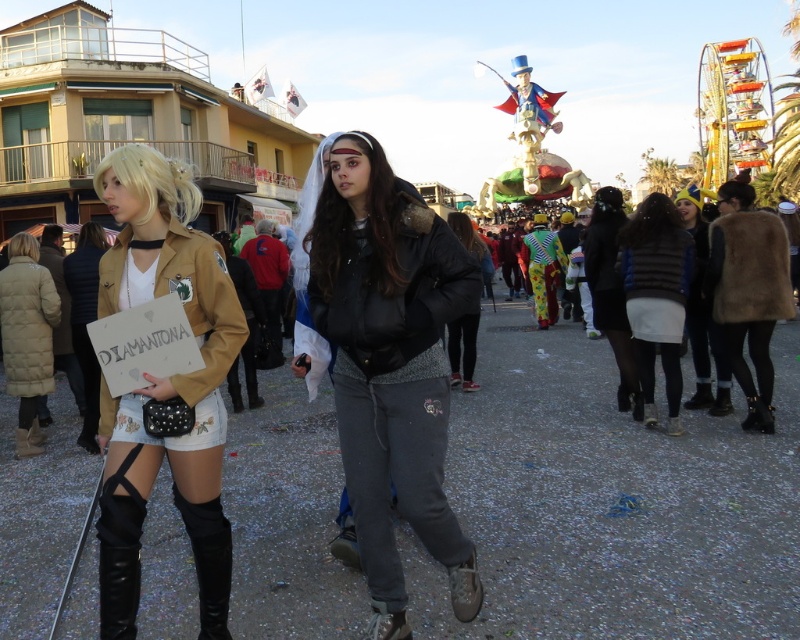
Between matte brown jacket at center and black leather jacket at center, which one appears on the left side from the viewer's perspective?

matte brown jacket at center

Is matte brown jacket at center closer to camera compared to black leather jacket at center?

Yes, it is.

At what (x,y) coordinates should I click in order to perform the action: click on matte brown jacket at center. Please return your answer as a coordinate pair (x, y). Looking at the image, I should click on (164, 387).

What do you see at coordinates (390, 364) in the screenshot? I see `matte black jacket at center` at bounding box center [390, 364].

Between point (380, 612) and point (645, 252), which one is positioned behind?

The point (645, 252) is behind.

Which is in front, point (341, 156) or point (662, 259)?

Positioned in front is point (341, 156).

At what (x,y) coordinates should I click in order to perform the action: click on matte black jacket at center. Please return your answer as a coordinate pair (x, y). This screenshot has width=800, height=640. Looking at the image, I should click on (390, 364).

Which is above, striped sweater at right or black leather jacket at center?

black leather jacket at center

Does striped sweater at right have a lesser height compared to black leather jacket at center?

Incorrect, striped sweater at right's height does not fall short of black leather jacket at center's.

Which is behind, point (637, 288) or point (462, 234)?

The point (462, 234) is more distant.

Locate an element on the screen. The width and height of the screenshot is (800, 640). striped sweater at right is located at coordinates (656, 298).